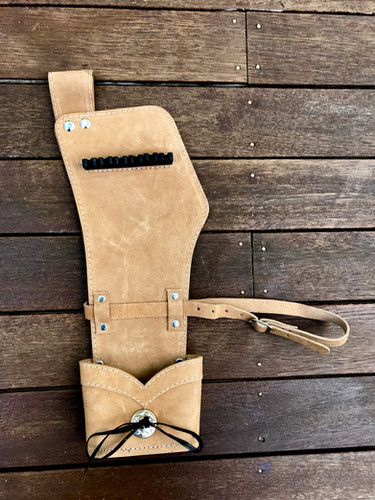
Where is `leather`? The height and width of the screenshot is (500, 375). leather is located at coordinates (142, 306).